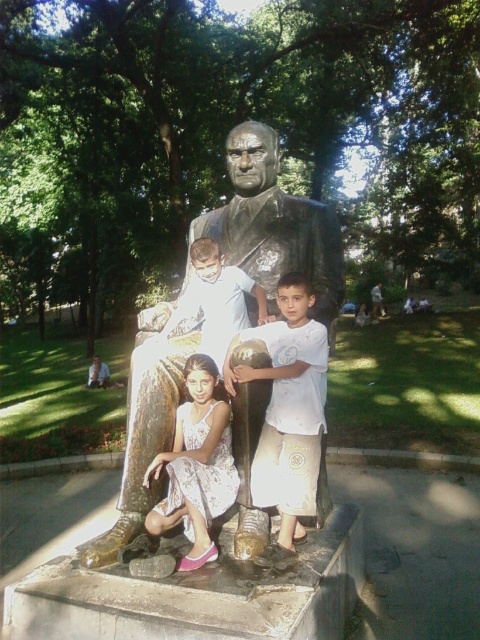
Question: Among these points, which one is farthest from the camera?

Choices:
 (A) (307, 346)
 (B) (263, 240)
 (C) (212, 388)
 (D) (259, 296)

Answer: (B)

Question: Is bronze statue at center below light brown skin at statue center?

Choices:
 (A) no
 (B) yes

Answer: (A)

Question: Is white cotton shirt at center to the right of light brown skin at statue center from the viewer's perspective?

Choices:
 (A) yes
 (B) no

Answer: (A)

Question: Which object is farther from the camera taking this photo?

Choices:
 (A) white floral dress at lower center
 (B) light brown skin at statue center

Answer: (B)

Question: Which point is farther to the camera?

Choices:
 (A) (271, 470)
 (B) (176, 492)

Answer: (A)

Question: Does white cotton shirt at center have a lesser width compared to white floral dress at lower center?

Choices:
 (A) yes
 (B) no

Answer: (B)